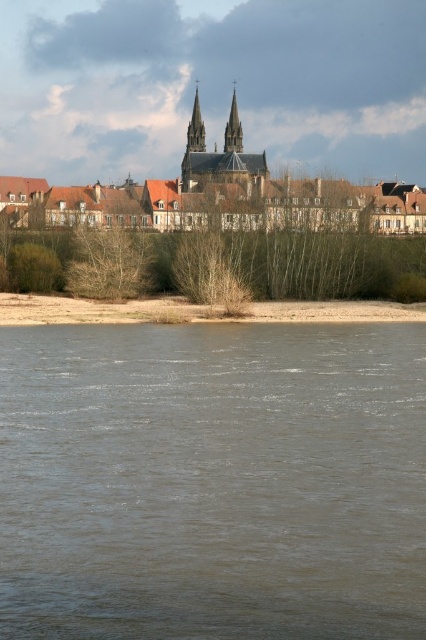
Question: Is brown stone buildings at upper center smaller than smooth stone spire at center?

Choices:
 (A) no
 (B) yes

Answer: (A)

Question: Is smooth stone spire at center below smooth gray stone spire at center?

Choices:
 (A) yes
 (B) no

Answer: (A)

Question: Is brown stone buildings at upper center in front of brown sandy shore at lower center?

Choices:
 (A) no
 (B) yes

Answer: (A)

Question: Estimate the real-world distances between objects in this image. Which object is closer to the brown sandy shore at lower center?

Choices:
 (A) brown tiled roofs at center
 (B) smooth gray stone spire at center

Answer: (A)

Question: Which point is closer to the camera?

Choices:
 (A) (141, 216)
 (B) (227, 132)

Answer: (A)

Question: Based on their relative distances, which object is nearer to the smooth stone spire at center?

Choices:
 (A) brown tiled roofs at center
 (B) brown stone buildings at upper center

Answer: (B)